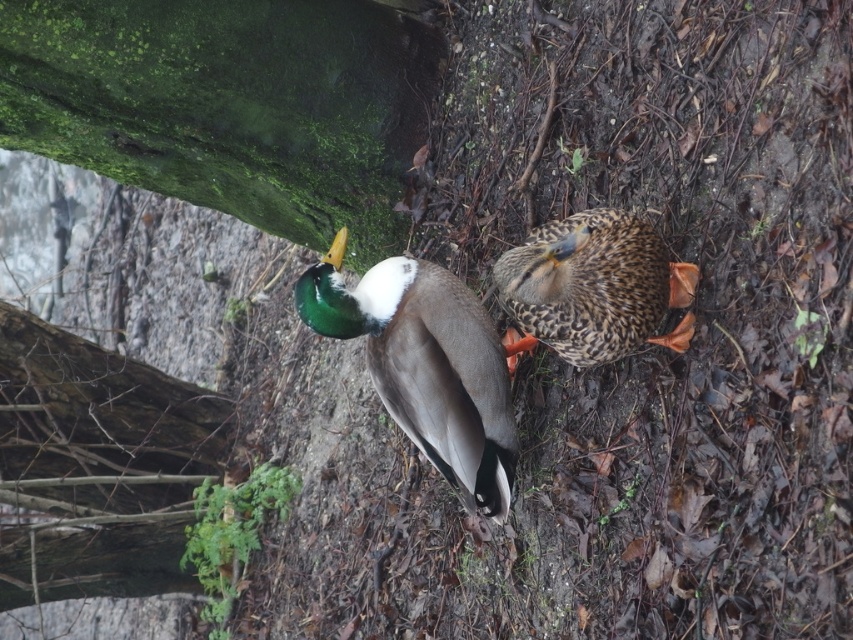
Question: Observing the image, what is the correct spatial positioning of green mossy tree trunk at upper left in reference to green glossy duck at center?

Choices:
 (A) above
 (B) below

Answer: (A)

Question: Does green glossy duck at center come behind speckled feathered duck at center?

Choices:
 (A) no
 (B) yes

Answer: (B)

Question: Which point appears closest to the camera in this image?

Choices:
 (A) (646, 289)
 (B) (339, 314)
 (C) (381, 163)

Answer: (A)

Question: Which point is closer to the camera taking this photo?

Choices:
 (A) (666, 291)
 (B) (498, 452)
 (C) (119, 588)

Answer: (A)

Question: Is green mossy tree trunk at upper left closer to the viewer compared to speckled feathered duck at center?

Choices:
 (A) no
 (B) yes

Answer: (A)

Question: Which of the following is the farthest from the observer?

Choices:
 (A) coord(219,161)
 (B) coord(503,449)
 (C) coord(659,323)

Answer: (A)